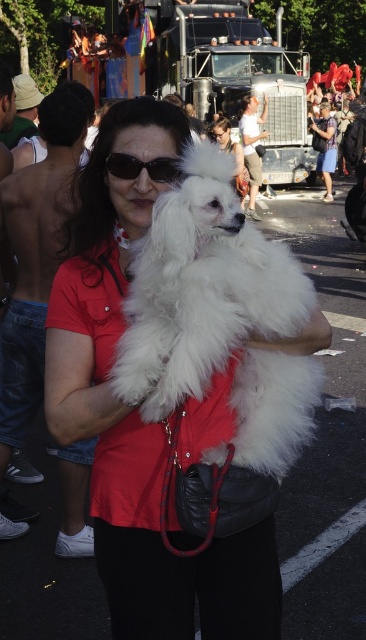
You are a photographer at the parade and want to capture both the matte red shirt at center and the black plastic sunglasses at center in one frame. Which object will appear larger in the photo?

The matte red shirt at center will appear larger in the photo because it is bigger than the black plastic sunglasses at center.

You are standing in the crowd watching the parade. There is a point at coordinates point (284,449) that you want to reach. Can you safely walk towards it without getting too close to the truck? The truck is located behind the woman holding the dog.

The point at coordinates point (284,449) is 1.65 meters away from you. Since the truck is behind the woman holding the dog, you can safely walk towards the point as long as you maintain a distance of at least 1.65 meters from the truck.

You are a photographer trying to capture the woman in the center of the image. You need to adjust your camera focus so that both the matte red shirt at center and the black plastic sunglasses at center are in sharp focus. Which object should you focus on first to ensure both are in focus?

The matte red shirt at center is located below black plastic sunglasses at center. To ensure both are in focus, you should focus on the black plastic sunglasses at center first since it is farther away from the camera than the matte red shirt at center.